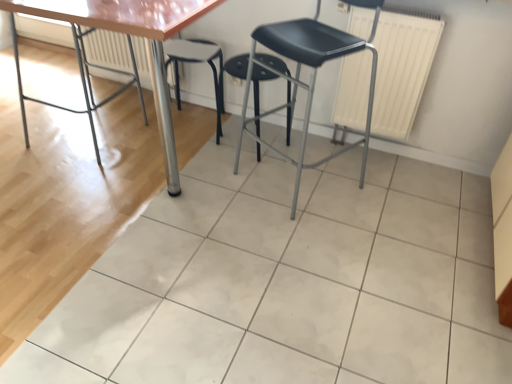
Locate an element on the screen. vacant area that is in front of black plastic stool at center, the second stool from the right is located at coordinates (183, 159).